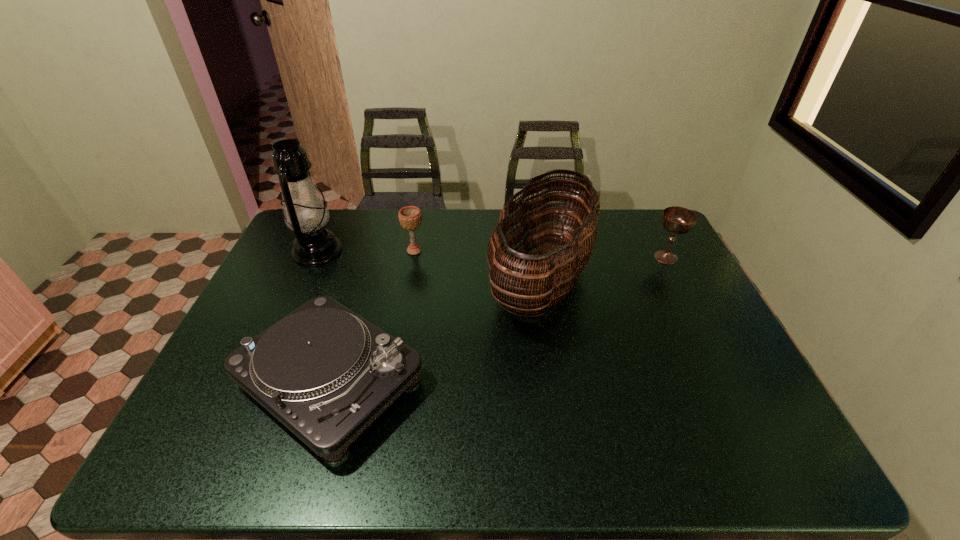
Locate an element on the screen. The width and height of the screenshot is (960, 540). vacant space that's between the left chalice and the record player is located at coordinates (372, 316).

At what (x,y) coordinates should I click in order to perform the action: click on vacant point located between the record player and the rightmost object. Please return your answer as a coordinate pair (x, y). The height and width of the screenshot is (540, 960). Looking at the image, I should click on (498, 319).

Where is `vacant point located between the left chalice and the shortest object`? The height and width of the screenshot is (540, 960). vacant point located between the left chalice and the shortest object is located at coordinates (372, 316).

Locate an element on the screen. The height and width of the screenshot is (540, 960). the third closest object to the fourth object from left to right is located at coordinates (x=410, y=217).

Identify which object is located as the second nearest to the record player. Please provide its 2D coordinates. Your answer should be formatted as a tuple, i.e. [(x, y)], where the tuple contains the x and y coordinates of a point satisfying the conditions above.

[(305, 212)]

Locate an element on the screen. The height and width of the screenshot is (540, 960). free spot that satisfies the following two spatial constraints: 1. on the back side of the fourth shortest object; 2. on the right side of the rightmost object is located at coordinates (538, 258).

The width and height of the screenshot is (960, 540). Find the location of `free space that satisfies the following two spatial constraints: 1. on the front side of the oil lamp; 2. on the left side of the right chalice`. free space that satisfies the following two spatial constraints: 1. on the front side of the oil lamp; 2. on the left side of the right chalice is located at coordinates (315, 258).

Identify the location of free region that satisfies the following two spatial constraints: 1. on the front side of the oil lamp; 2. on the right side of the shortest object. Image resolution: width=960 pixels, height=540 pixels. (258, 381).

This screenshot has width=960, height=540. I want to click on blank area in the image that satisfies the following two spatial constraints: 1. on the back side of the rightmost object; 2. on the right side of the basket, so click(x=538, y=258).

The image size is (960, 540). I want to click on vacant space that satisfies the following two spatial constraints: 1. on the back side of the second object from right to left; 2. on the left side of the right chalice, so click(x=538, y=258).